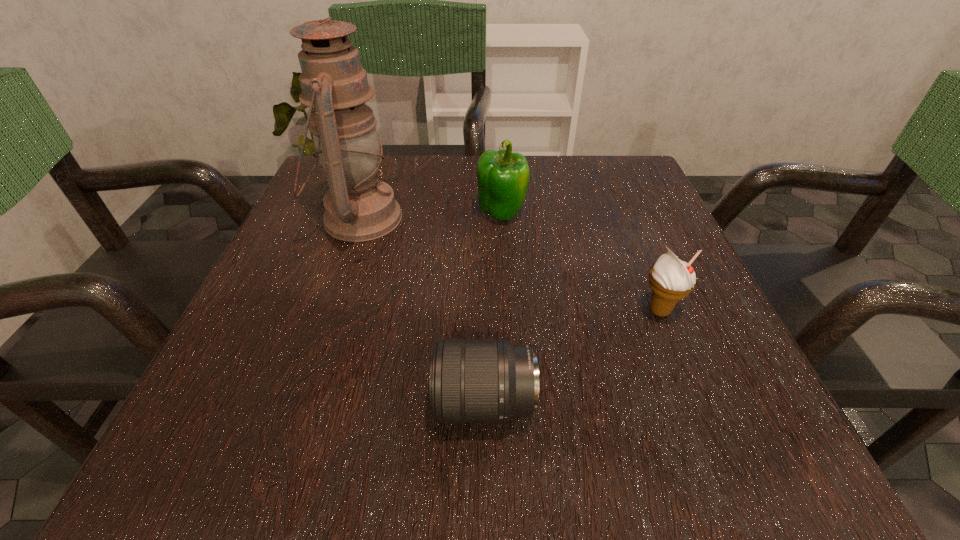
Identify the location of vacant area that lies between the leftmost object and the bell pepper. The image size is (960, 540). (430, 216).

I want to click on free point between the bell pepper and the shortest object, so click(x=493, y=308).

I want to click on vacant space in between the oil lamp and the shortest object, so click(421, 310).

Identify the location of vacant space that's between the bell pepper and the oil lamp. (430, 216).

Select which object appears as the third closest to the third shortest object. Please provide its 2D coordinates. Your answer should be formatted as a tuple, i.e. [(x, y)], where the tuple contains the x and y coordinates of a point satisfying the conditions above.

[(471, 380)]

This screenshot has height=540, width=960. I want to click on object that stands as the closest to the second nearest object, so click(x=471, y=380).

Find the location of a particular element. Image resolution: width=960 pixels, height=540 pixels. free space that satisfies the following two spatial constraints: 1. on the front side of the oil lamp; 2. on the left side of the third farthest object is located at coordinates (327, 310).

Find the location of a particular element. This screenshot has height=540, width=960. free space that satisfies the following two spatial constraints: 1. on the back side of the leftmost object; 2. on the right side of the third shortest object is located at coordinates (361, 213).